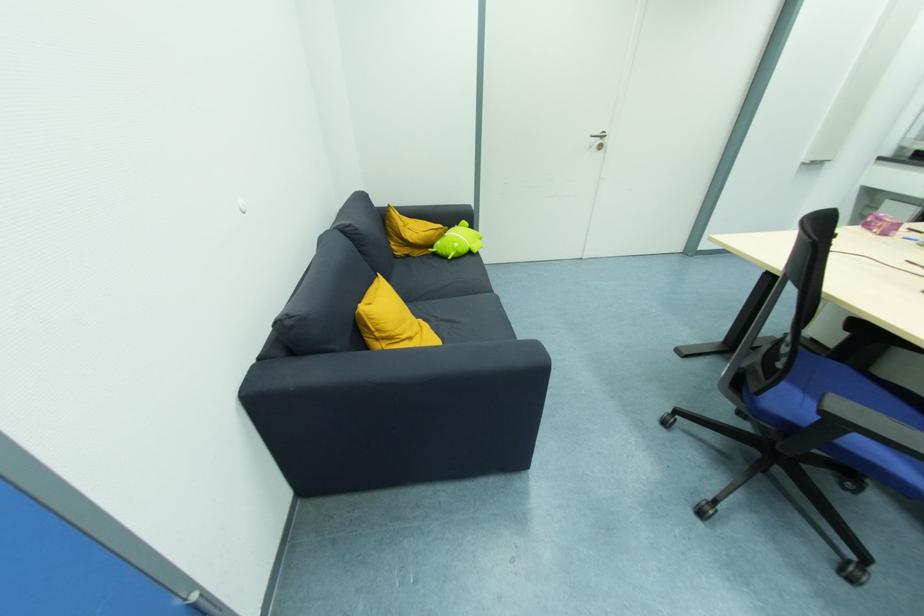
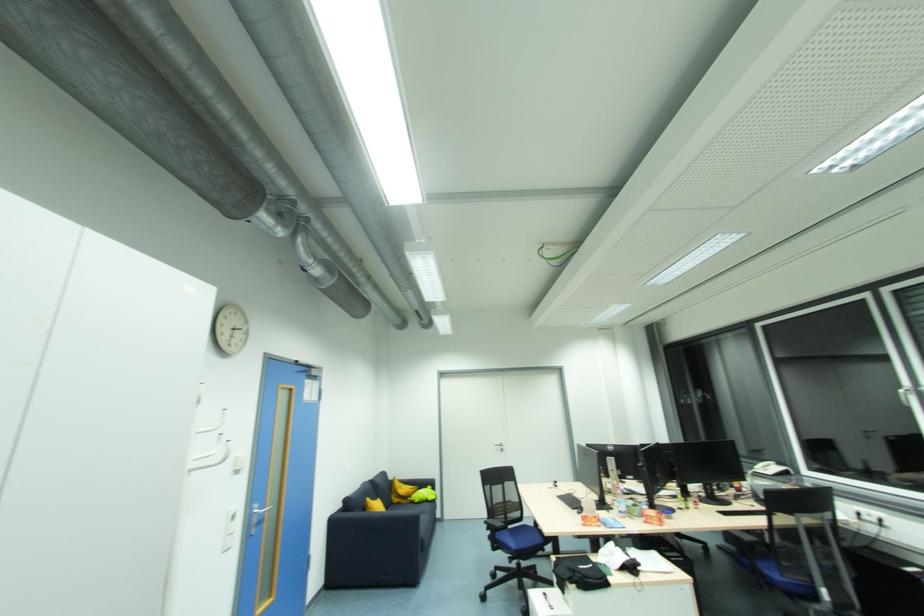
Where in the second image is the point corresponding to point (403, 253) from the first image?

(397, 501)